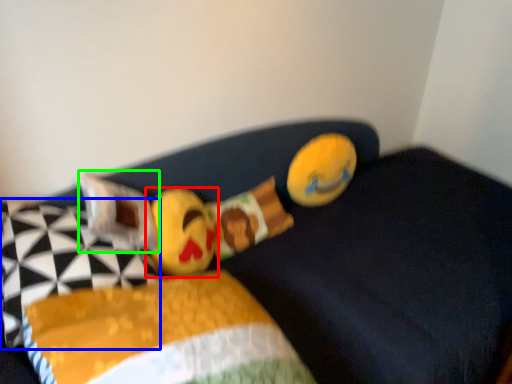
Question: Which is farther away from toy (highlighted by a red box)? pillow (highlighted by a blue box) or pillow (highlighted by a green box)?

Choices:
 (A) pillow
 (B) pillow

Answer: (A)